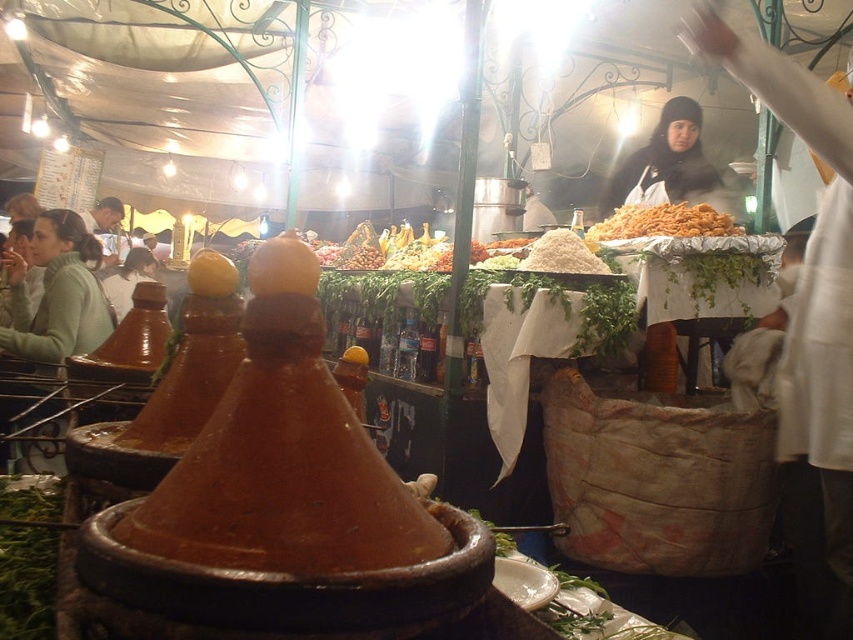
Which is above, black fabric headscarf at upper center or golden crispy fried food at center?

Positioned higher is black fabric headscarf at upper center.

Does black fabric headscarf at upper center have a larger size compared to golden crispy fried food at center?

Indeed, black fabric headscarf at upper center has a larger size compared to golden crispy fried food at center.

This screenshot has height=640, width=853. What are the coordinates of `black fabric headscarf at upper center` in the screenshot? It's located at (670, 164).

Is black fabric headscarf at upper center positioned at the back of white powdery rice at center?

That is True.

Is point (671, 156) more distant than point (573, 269)?

Yes, point (671, 156) is behind point (573, 269).

Image resolution: width=853 pixels, height=640 pixels. What are the coordinates of `black fabric headscarf at upper center` in the screenshot? It's located at (670, 164).

Which is behind, point (680, 209) or point (567, 250)?

The point (680, 209) is more distant.

Image resolution: width=853 pixels, height=640 pixels. Describe the element at coordinates (664, 221) in the screenshot. I see `golden crispy fried food at center` at that location.

Locate an element on the screen. golden crispy fried food at center is located at coordinates (664, 221).